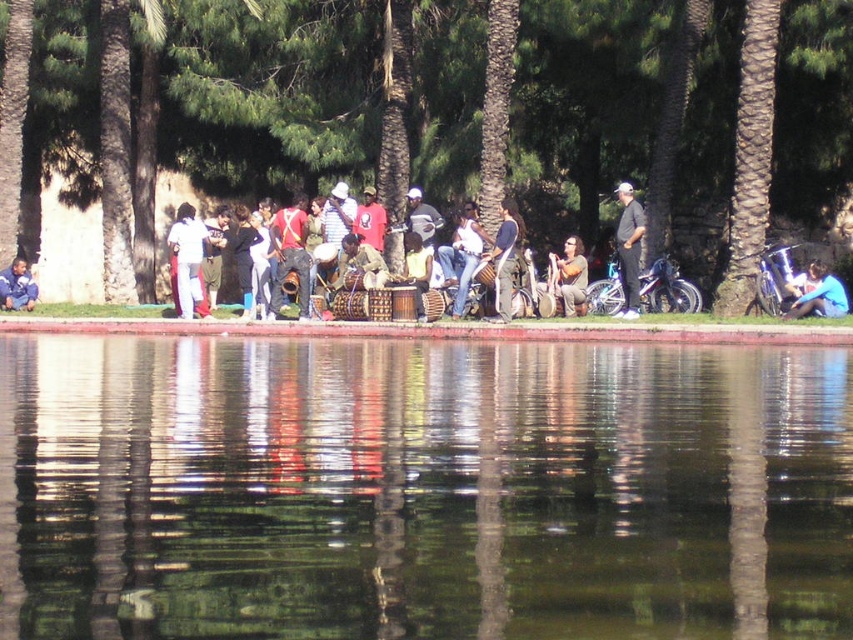
This screenshot has width=853, height=640. In order to click on white cotton shirt at center in this screenshot , I will do `click(187, 262)`.

Who is positioned more to the left, white cotton shirt at center or brushed metal jacket at center?

Positioned to the left is brushed metal jacket at center.

Is point (177, 266) positioned after point (9, 289)?

No, (177, 266) is in front of (9, 289).

This screenshot has width=853, height=640. In order to click on white cotton shirt at center in this screenshot , I will do `click(187, 262)`.

Can you confirm if transparent glass water at center is positioned to the right of denim jeans at center?

In fact, transparent glass water at center is to the left of denim jeans at center.

Can you confirm if transparent glass water at center is positioned below denim jeans at center?

Yes, transparent glass water at center is below denim jeans at center.

Between point (675, 392) and point (479, 244), which one is positioned behind?

Positioned behind is point (479, 244).

Locate an element on the screen. The image size is (853, 640). transparent glass water at center is located at coordinates (421, 490).

Does transparent glass water at center have a lesser width compared to white cotton shirt at center?

Incorrect, transparent glass water at center's width is not less than white cotton shirt at center's.

Does transparent glass water at center have a lesser height compared to white cotton shirt at center?

Correct, transparent glass water at center is not as tall as white cotton shirt at center.

Is point (683, 628) positioned behind point (187, 236)?

No, it is not.

At what (x,y) coordinates should I click in order to perform the action: click on transparent glass water at center. Please return your answer as a coordinate pair (x, y). This screenshot has height=640, width=853. Looking at the image, I should click on (421, 490).